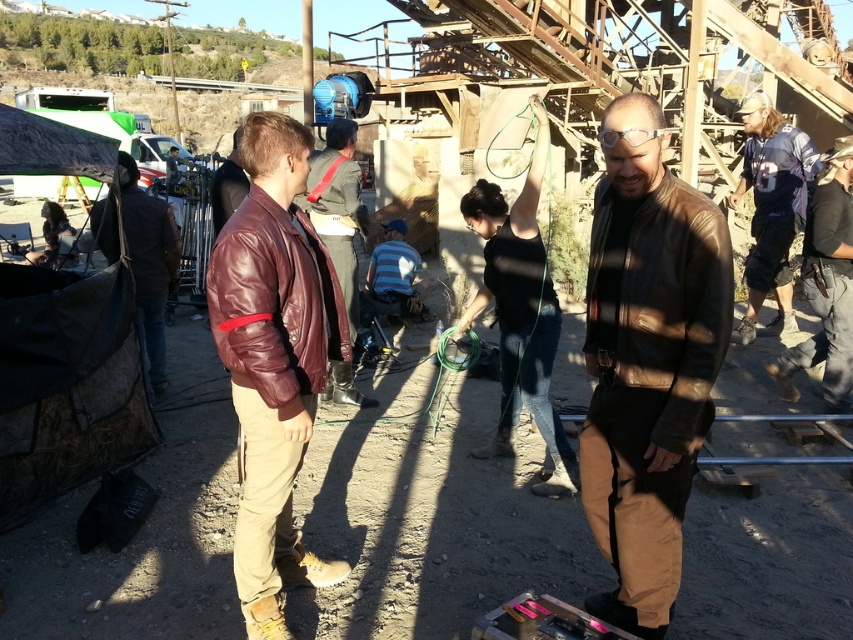
Is blue jersey at right behind leather jacket at center?

Yes, blue jersey at right is behind leather jacket at center.

How far apart are blue jersey at right and leather jacket at center?

blue jersey at right is 3.44 meters from leather jacket at center.

Who is more forward, [816,154] or [314,198]?

Point [314,198]

Identify the location of blue jersey at right. This screenshot has width=853, height=640. (770, 209).

I want to click on burgundy leather jacket at center, so click(273, 358).

Does burgundy leather jacket at center appear under maroon leather jacket at center?

Yes.

Does point (279, 132) come closer to viewer compared to point (99, 225)?

Yes, point (279, 132) is in front of point (99, 225).

Image resolution: width=853 pixels, height=640 pixels. What are the coordinates of `burgundy leather jacket at center` in the screenshot? It's located at (273, 358).

Consider the image. Which is below, maroon leather jacket at center or metallic pink tool at center?

Positioned lower is metallic pink tool at center.

Find the location of a particular element. maroon leather jacket at center is located at coordinates (149, 266).